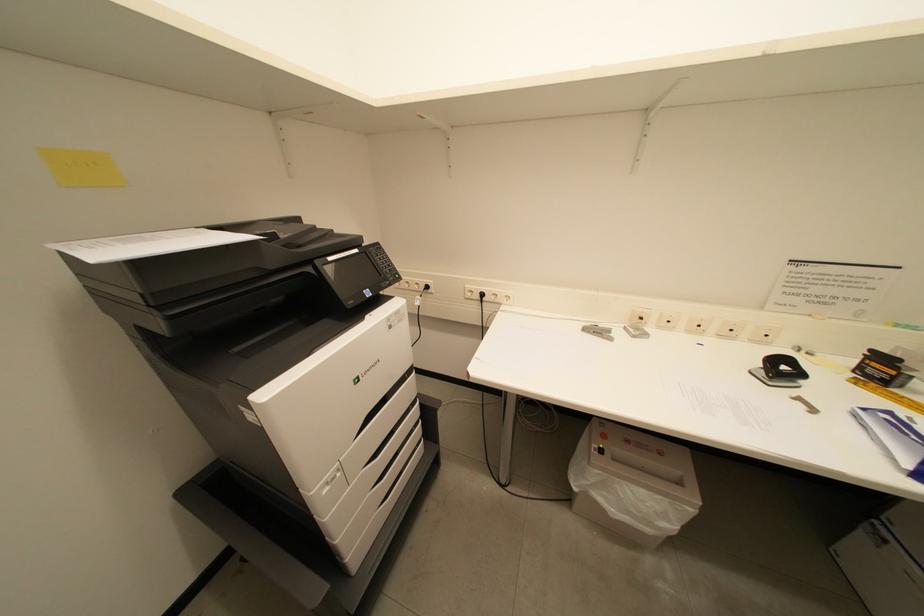
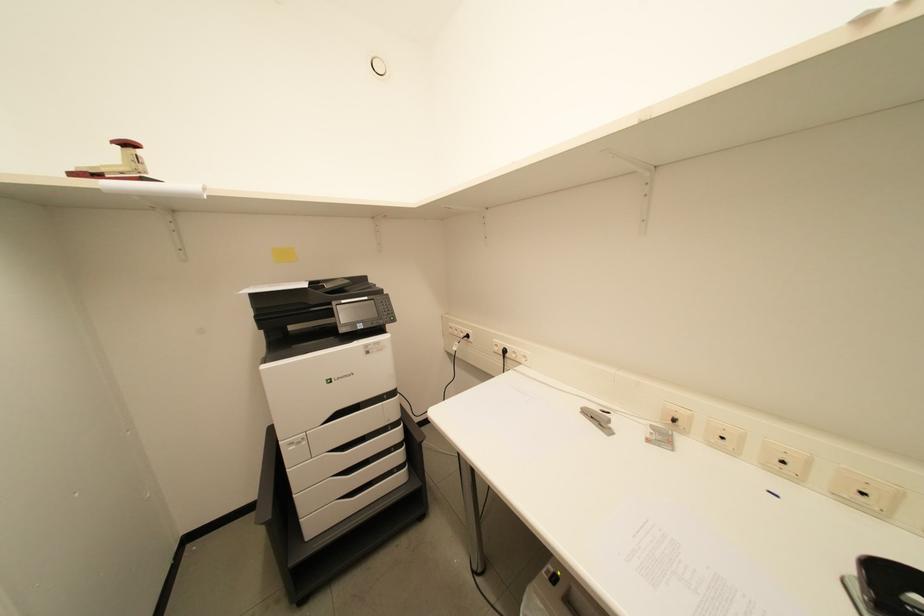
Question: The camera is either moving clockwise (left) or counter-clockwise (right) around the object. The first image is from the beginning of the video and the second image is from the end. Is the camera moving left or right when shooting the video?

Choices:
 (A) Left
 (B) Right

Answer: (B)